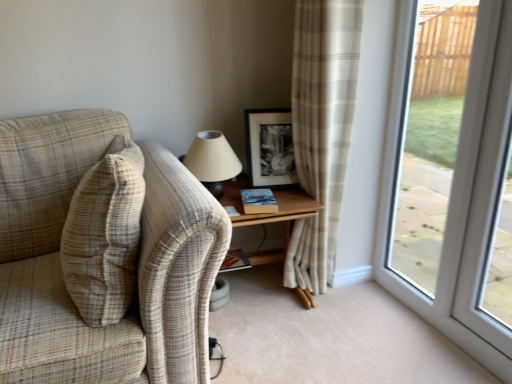
The height and width of the screenshot is (384, 512). In order to click on unoccupied space behind hardcover book at center, the second book viewed from the left in this screenshot , I will do `click(269, 188)`.